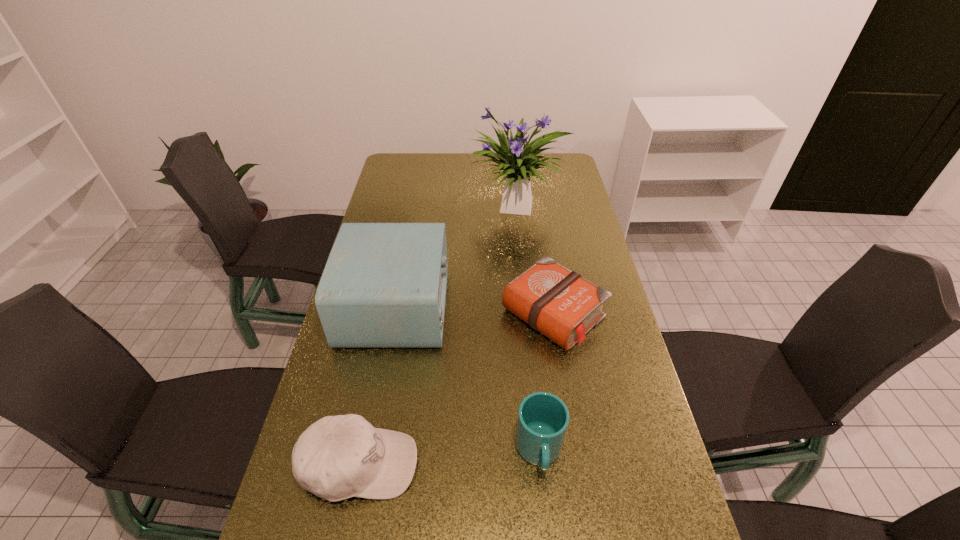
Locate an element on the screen. free space between the baseball cap and the cup is located at coordinates tap(449, 458).

In order to click on free space that is in between the shortest object and the cup in this screenshot , I will do `click(546, 382)`.

Locate an element on the screen. free space between the Bible and the flower arrangement is located at coordinates (535, 261).

The height and width of the screenshot is (540, 960). Identify the location of the second closest object to the baseball cap. (384, 285).

Identify which object is the nearest to the cup. Please provide its 2D coordinates. Your answer should be formatted as a tuple, i.e. [(x, y)], where the tuple contains the x and y coordinates of a point satisfying the conditions above.

[(559, 303)]

The height and width of the screenshot is (540, 960). In order to click on vacant region that satisfies the following two spatial constraints: 1. on the handle side of the cup; 2. on the front-facing side of the baseball cap in this screenshot , I will do `click(540, 464)`.

Image resolution: width=960 pixels, height=540 pixels. Find the location of `free space that satisfies the following two spatial constraints: 1. on the handle side of the cup; 2. on the front-facing side of the baseball cap`. free space that satisfies the following two spatial constraints: 1. on the handle side of the cup; 2. on the front-facing side of the baseball cap is located at coordinates (540, 464).

Find the location of a particular element. Image resolution: width=960 pixels, height=540 pixels. free space in the image that satisfies the following two spatial constraints: 1. on the handle side of the cup; 2. on the front-facing side of the baseball cap is located at coordinates (540, 464).